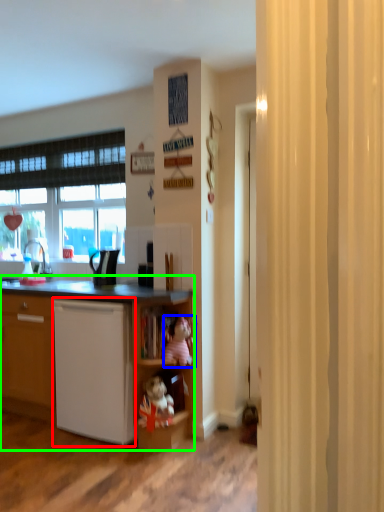
Question: Estimate the real-world distances between objects in this image. Which object is closer to dish washer (highlighted by a red box), toy (highlighted by a blue box) or cupboard (highlighted by a green box)?

Choices:
 (A) toy
 (B) cupboard

Answer: (B)